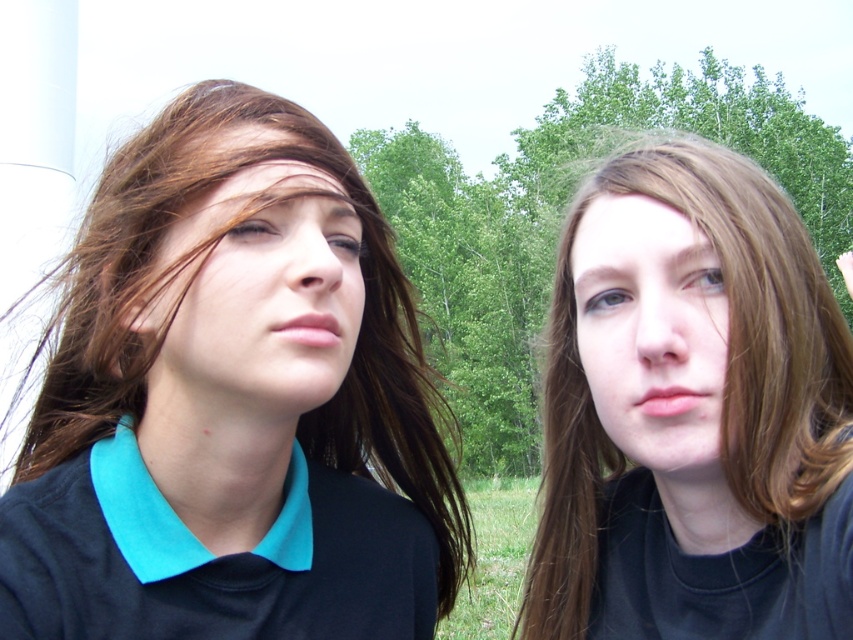
Question: Is smooth brown hair at upper right thinner than smooth skin face at right?

Choices:
 (A) no
 (B) yes

Answer: (A)

Question: Can you confirm if matte black shirt at left is positioned below smooth skin face at right?

Choices:
 (A) no
 (B) yes

Answer: (B)

Question: Is smooth brown hair at upper right above matte black hair at center?

Choices:
 (A) no
 (B) yes

Answer: (B)

Question: Which point is farther to the camera?

Choices:
 (A) (325, 536)
 (B) (283, 204)
 (C) (276, 300)
 (D) (614, 419)

Answer: (A)

Question: Which is farther from the matte black hair at center?

Choices:
 (A) smooth brown hair at upper right
 (B) smooth skin face at right
 (C) teal fabric polo shirt at left
 (D) matte black shirt at left

Answer: (A)

Question: Which of the following is the farthest from the observer?

Choices:
 (A) (560, 586)
 (B) (151, 368)
 (C) (172, 128)
 (D) (374, 577)

Answer: (A)